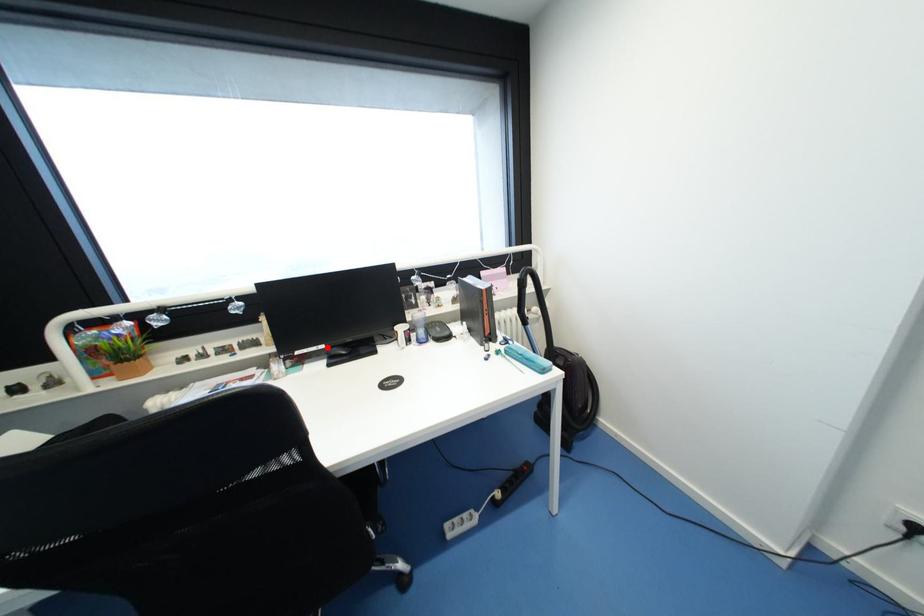
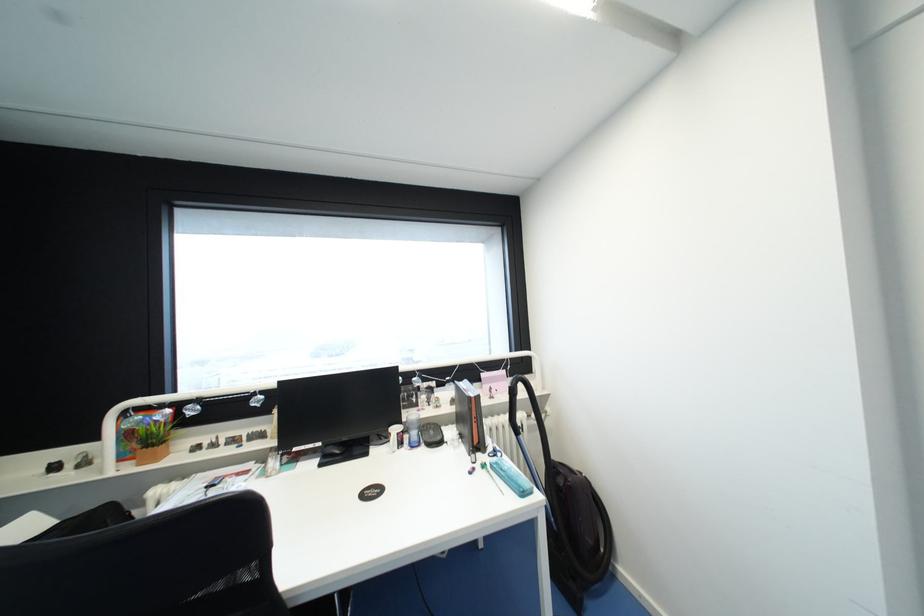
Question: A red point is marked in image1. In image2, is the corresponding 3D point closer to the camera or farther? Reply with the corresponding letter.

Choices:
 (A) The corresponding 3D point is closer.
 (B) The corresponding 3D point is farther.

Answer: (B)